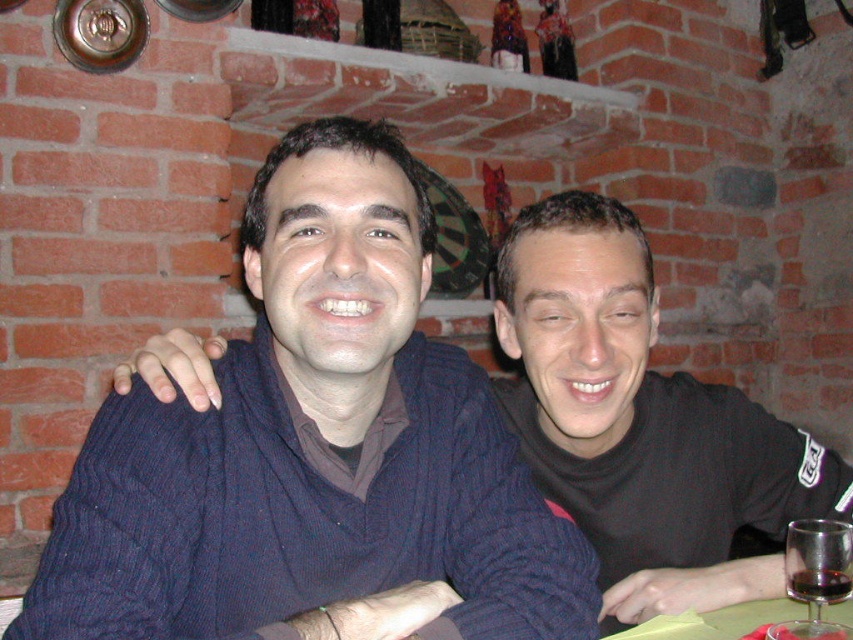
You are a bartender at a cozy dinner party and need to pour the dark red liquid at lower right into the transparent glass at lower right. Can you do this without spilling?

The transparent glass at lower right is closer to the viewer than the dark red liquid at lower right, so you can pour the dark red liquid at lower right into the transparent glass at lower right without spilling.